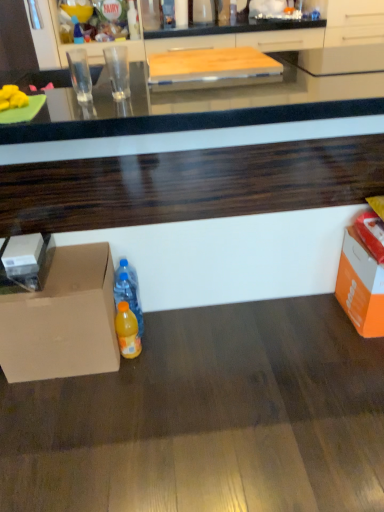
Question: Looking at their shapes, would you say orange cardboard box at lower right is wider or thinner than translucent plastic bottle at upper left, marked as the 1th bottle in a left-to-right arrangement?

Choices:
 (A) thin
 (B) wide

Answer: (B)

Question: Considering their positions, is orange cardboard box at lower right located in front of or behind translucent plastic bottle at upper left, placed as the 3th bottle when sorted from front to back?

Choices:
 (A) front
 (B) behind

Answer: (A)

Question: Estimate the real-world distances between objects in this image. Which object is closer to the matte cardboard box at lower left?

Choices:
 (A) translucent plastic bottle at upper left, positioned as the third bottle in right-to-left order
 (B) white cardboard box at left
 (C) orange plastic bottle at lower center, the 3th bottle positioned from the left
 (D) orange cardboard box at lower right
 (E) yellow matte bananas at left

Answer: (B)

Question: Which object is the farthest from the white cardboard box at left?

Choices:
 (A) translucent plastic bottle at upper left, marked as the first bottle in a top-to-bottom arrangement
 (B) orange cardboard box at lower right
 (C) orange plastic bottle at lower center, the 3th bottle when ordered from top to bottom
 (D) translucent plastic bottle at center, which is the second bottle in left-to-right order
 (E) yellow matte bananas at left

Answer: (A)